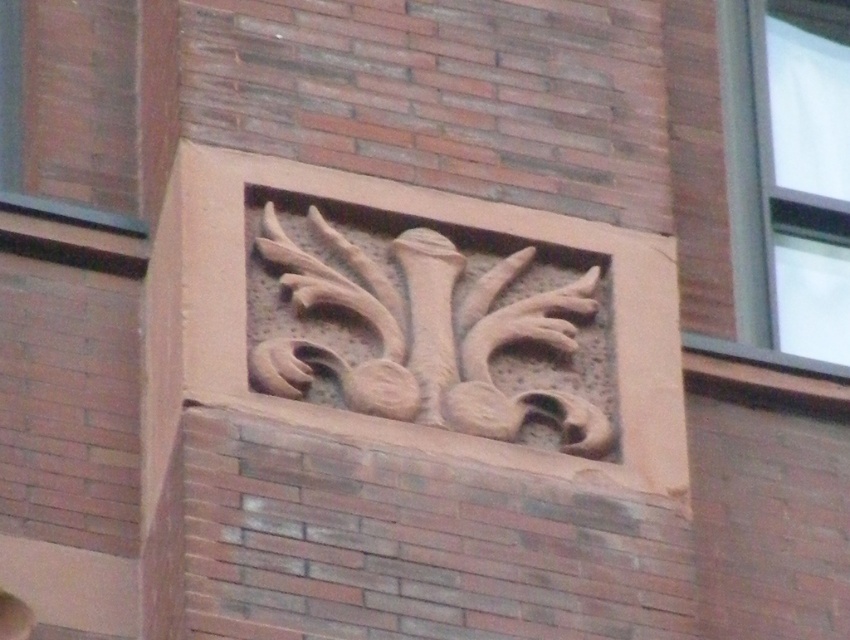
You are a painter standing at the base of the brick building. You want to paint both the brown stone relief at center and the clear glass window at upper right. Given that your ladder can reach up to 10 meters, can you safely paint both objects without moving the ladder?

The brown stone relief at center and the clear glass window at upper right are 9.87 meters apart from each other. Since the ladder can reach up to 10 meters, you can safely paint both objects without moving the ladder as the distance between them is within the ladder reach.

You are an architect examining the brick building. You notice the brown stone relief at center and the clear glass window at upper right. Which object is located to the left of the other?

The brown stone relief at center is positioned on the left side of clear glass window at upper right.